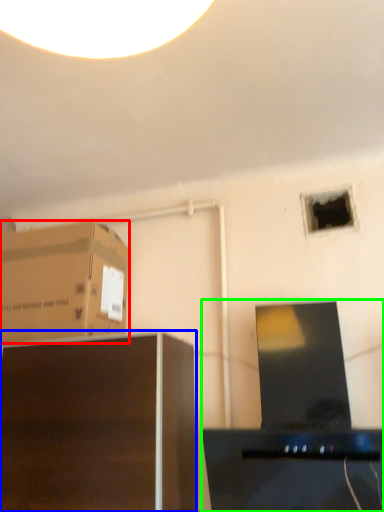
Question: Which object is the closest to the cardboard box (highlighted by a red box)? Choose among these: furniture (highlighted by a blue box) or desktop computer (highlighted by a green box).

Choices:
 (A) furniture
 (B) desktop computer

Answer: (A)